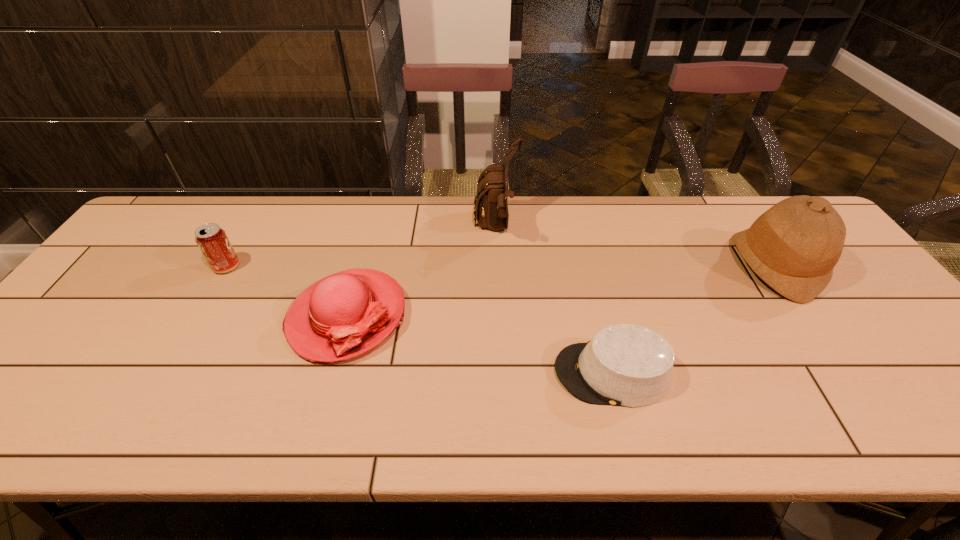
Where is `hat at the far edge`? Image resolution: width=960 pixels, height=540 pixels. hat at the far edge is located at coordinates (793, 247).

Locate an element on the screen. This screenshot has height=540, width=960. object present at the near edge is located at coordinates (628, 365).

Image resolution: width=960 pixels, height=540 pixels. Identify the location of object located at the right edge. (793, 247).

Image resolution: width=960 pixels, height=540 pixels. I want to click on object located in the far right corner section of the desktop, so click(793, 247).

Find the location of `free space at the far edge of the desktop`. free space at the far edge of the desktop is located at coordinates (642, 222).

In order to click on free region at the near edge in this screenshot , I will do `click(813, 435)`.

Image resolution: width=960 pixels, height=540 pixels. In the image, there is a desktop. What are the coordinates of `vacant space at the left edge` in the screenshot? It's located at (68, 330).

Image resolution: width=960 pixels, height=540 pixels. What are the coordinates of `free location at the right edge` in the screenshot? It's located at (908, 342).

In the image, there is a desktop. Identify the location of free space at the near left corner. Image resolution: width=960 pixels, height=540 pixels. (21, 420).

Identify the location of free space at the far right corner. The width and height of the screenshot is (960, 540). (753, 197).